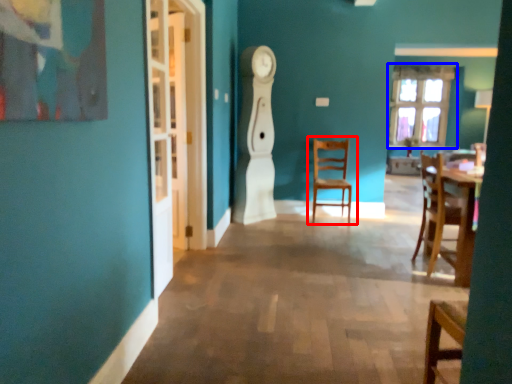
Question: Which point is closer to the camera, chair (highlighted by a red box) or window (highlighted by a blue box)?

Choices:
 (A) chair
 (B) window

Answer: (A)